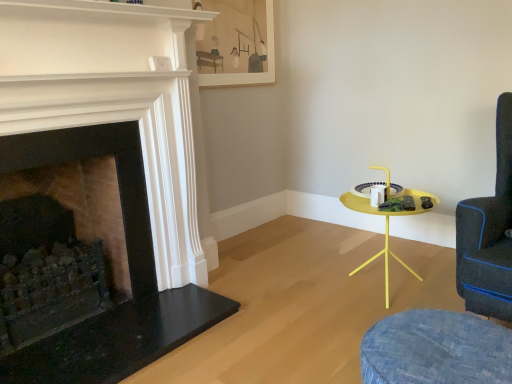
Locate an element on the screen. free space that is to the left of yellow matte side table at right is located at coordinates (302, 302).